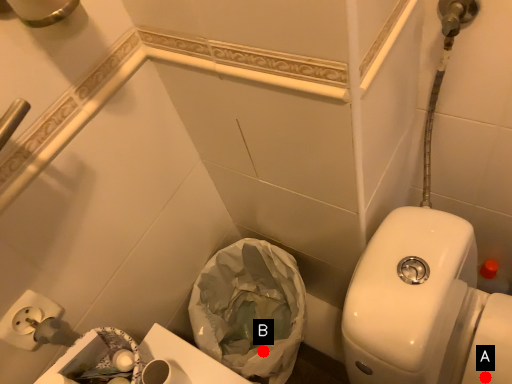
Question: Two points are circled on the image, labeled by A and B beside each circle. Which point is closer to the camera?

Choices:
 (A) A is closer
 (B) B is closer

Answer: (A)